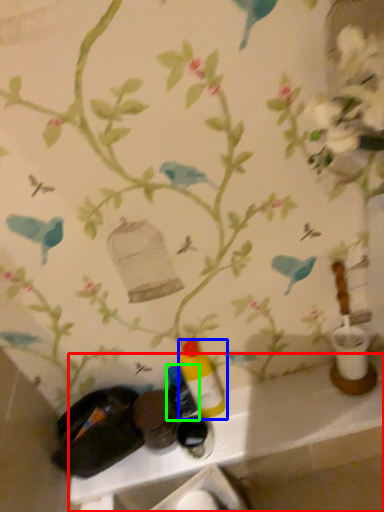
Question: Considering the real-world distances, which object is farthest from counter (highlighted by a red box)? bottle (highlighted by a blue box) or bottle (highlighted by a green box)?

Choices:
 (A) bottle
 (B) bottle

Answer: (B)